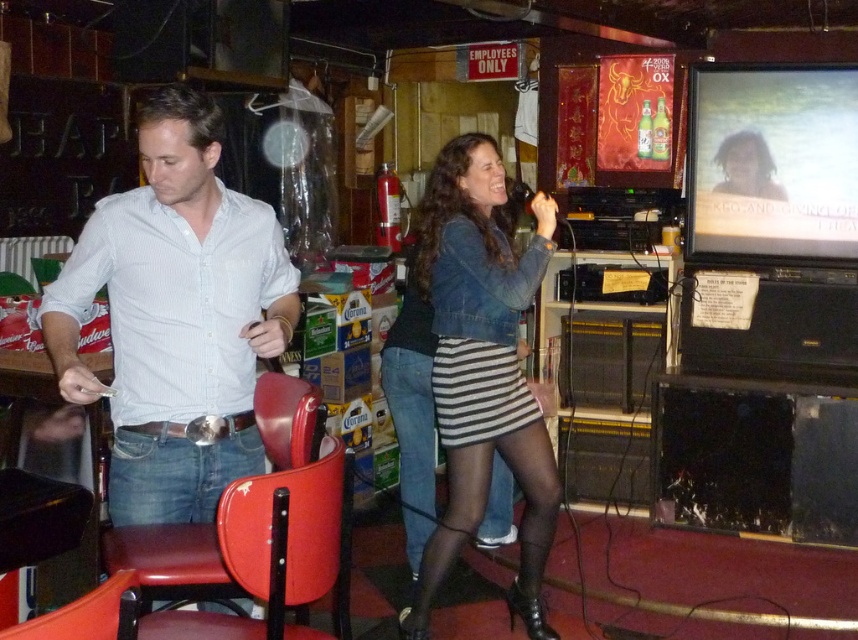
You are a guest at the karaoke bar and want to borrow a jacket to stay warm. You see the denim jacket at center and the metallic red chair at lower left. Which object is closer to the right side of the room?

The denim jacket at center is to the right of metallic red chair at lower left, so the denim jacket at center is closer to the right side of the room.

You are a person with a 20 inch wide wheelchair. You want to move from the metallic red chair at lower left to the red leather chair at center. Is there enough space between them for your wheelchair to pass through?

The distance between the red leather chair at center and metallic red chair at lower left is 20.81 inches. Since your wheelchair is 20 inches wide, there is enough space for you to pass through.

You are a guest at the karaoke bar and want to sit down. There are two chairs available. Which chair is closer to the singing man on the left? The red leather chair at center or the metallic red chair at lower left?

The metallic red chair at lower left is closer to the singing man on the left because the red leather chair at center is positioned to the right of it.